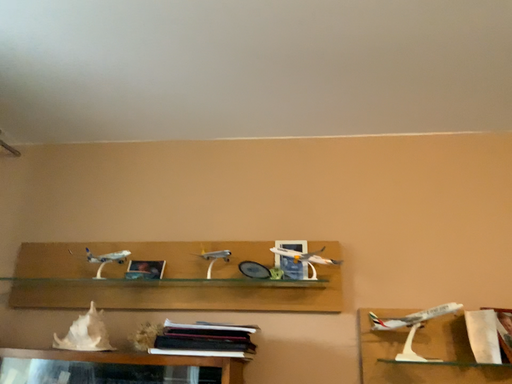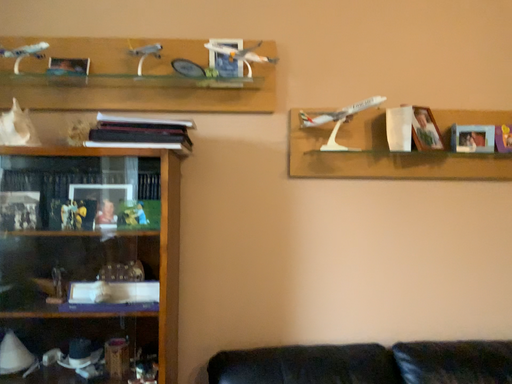
Question: Which way did the camera rotate in the video?

Choices:
 (A) rotated downward
 (B) rotated upward

Answer: (A)